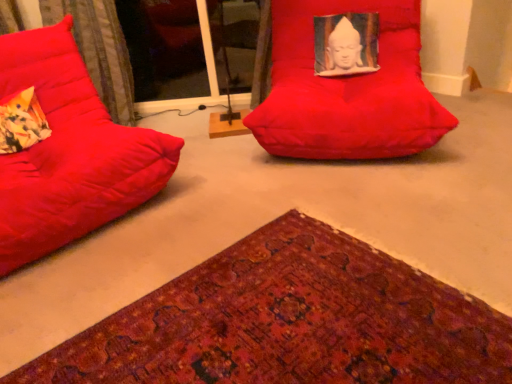
You are a GUI agent. You are given a task and a screenshot of the screen. Output one action in this format:
    pyautogui.click(x=<x>, y=<y>)
    Task: Click on the free space between matte red beanbag at center, which is the 1th furniture from right to left, and textured woolen mat at lower left
    The height and width of the screenshot is (384, 512).
    Given the screenshot: What is the action you would take?
    pyautogui.click(x=318, y=212)